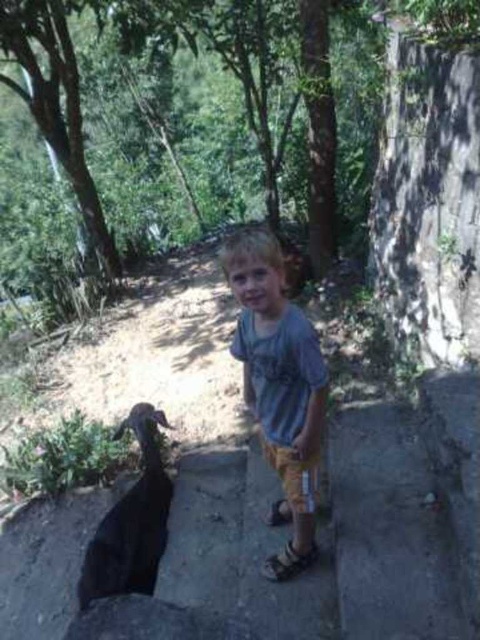
Question: Which point appears farthest from the camera in this image?

Choices:
 (A) (252, 228)
 (B) (135, 538)

Answer: (B)

Question: Is light blue cotton shirt at center closer to camera compared to black matte goat at lower left?

Choices:
 (A) yes
 (B) no

Answer: (A)

Question: Which point is closer to the camera taking this photo?

Choices:
 (A) (308, 452)
 (B) (152, 461)

Answer: (A)

Question: Is light blue cotton shirt at center positioned behind black matte goat at lower left?

Choices:
 (A) yes
 (B) no

Answer: (B)

Question: Considering the relative positions of light blue cotton shirt at center and black matte goat at lower left in the image provided, where is light blue cotton shirt at center located with respect to black matte goat at lower left?

Choices:
 (A) above
 (B) below

Answer: (A)